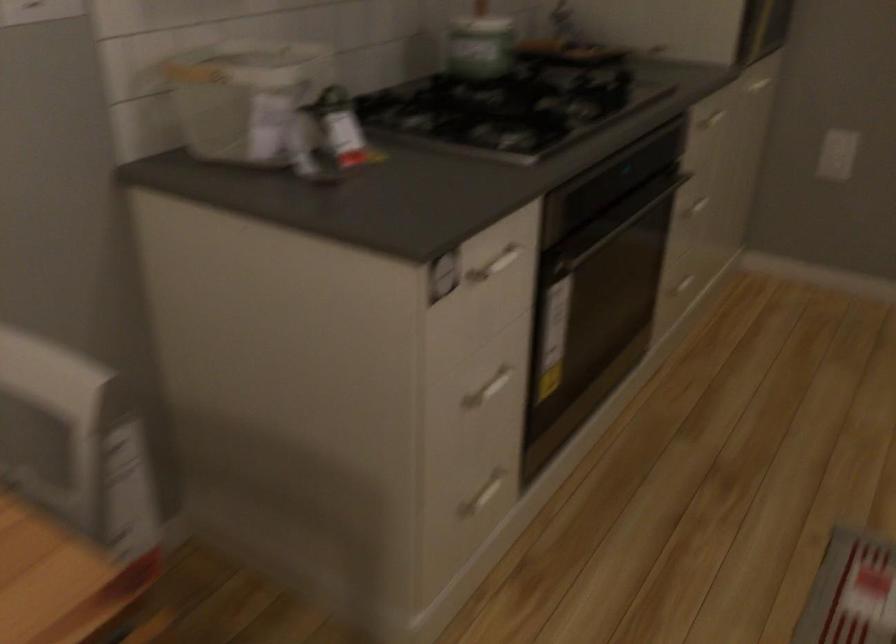
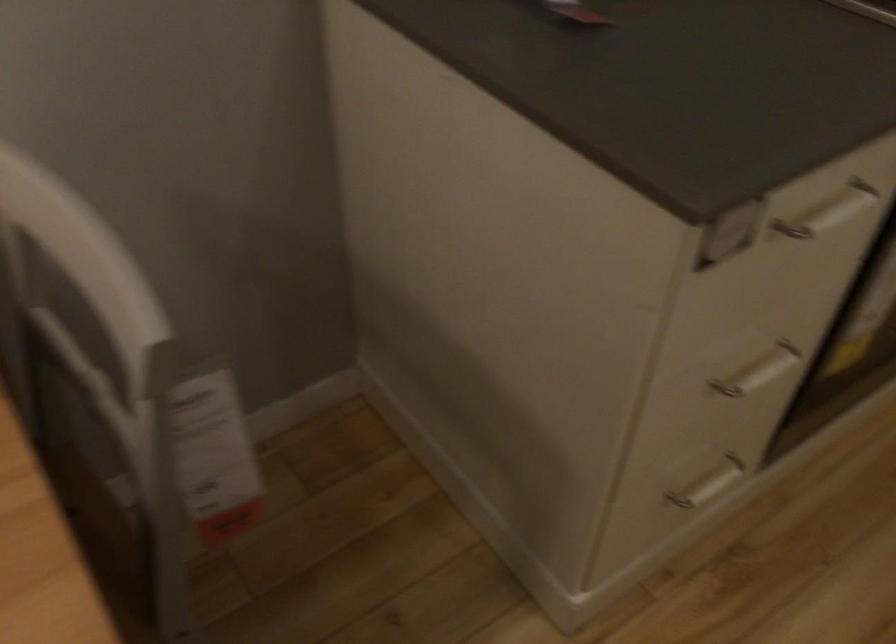
First-person continuous shooting, in which direction is the camera rotating?

The rotation direction of the camera is left-down.